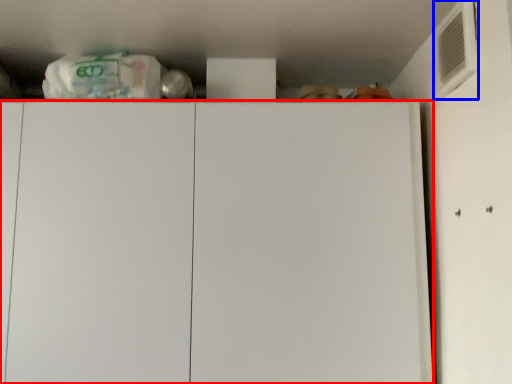
Question: Which point is closer to the camera, cabinetry (highlighted by a red box) or air conditioning (highlighted by a blue box)?

Choices:
 (A) cabinetry
 (B) air conditioning

Answer: (B)